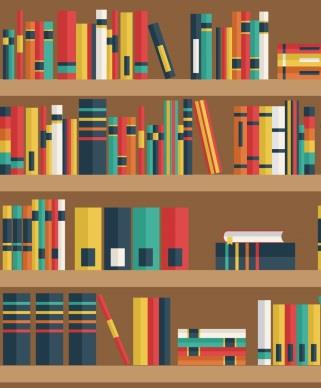
What are the coordinates of `shelves` in the screenshot? It's located at (132, 373), (142, 279), (145, 183), (140, 87).